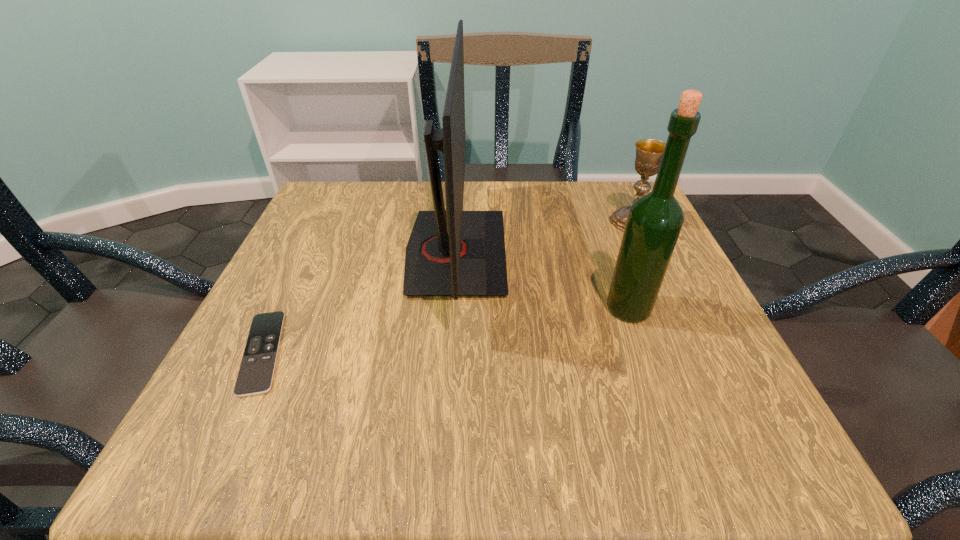
Locate an element on the screen. chalice that is at the far edge is located at coordinates (649, 152).

Find the location of a particular element. Image resolution: width=960 pixels, height=540 pixels. object that is at the left edge is located at coordinates point(255,376).

You are a GUI agent. You are given a task and a screenshot of the screen. Output one action in this format:
    pyautogui.click(x=<x>, y=<y>)
    Task: Click on the liquor located at the right edge
    This screenshot has height=540, width=960.
    Given the screenshot: What is the action you would take?
    point(654,222)

Find the location of `chalice present at the right edge`. chalice present at the right edge is located at coordinates (649, 152).

What are the coordinates of `object that is positioned at the far right corner` in the screenshot? It's located at (649, 152).

What are the coordinates of `vacant space at the far edge of the desktop` in the screenshot? It's located at (511, 228).

Image resolution: width=960 pixels, height=540 pixels. Identify the location of vacant area at the near edge. (476, 416).

Locate an element on the screen. vacant space at the left edge is located at coordinates (360, 268).

Where is `vacant space at the right edge`? vacant space at the right edge is located at coordinates (638, 381).

In the image, there is a desktop. Where is `vacant space at the far left corner`? vacant space at the far left corner is located at coordinates (383, 181).